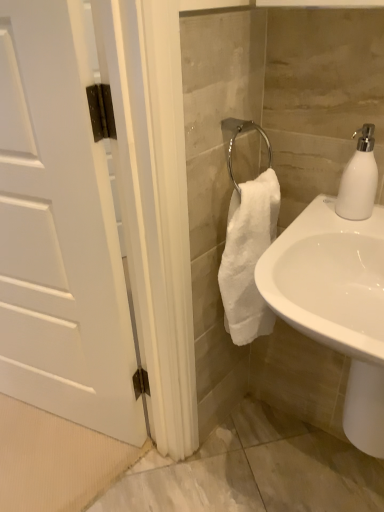
Question: Can you see white matte soap dispenser at upper right touching white matte door at left?

Choices:
 (A) no
 (B) yes

Answer: (A)

Question: Does white matte soap dispenser at upper right have a larger size compared to white matte door at left?

Choices:
 (A) no
 (B) yes

Answer: (A)

Question: From the image's perspective, is white matte soap dispenser at upper right beneath white matte door at left?

Choices:
 (A) yes
 (B) no

Answer: (B)

Question: Is white matte door at left a part of white matte soap dispenser at upper right?

Choices:
 (A) no
 (B) yes

Answer: (A)

Question: From a real-world perspective, is white matte soap dispenser at upper right physically below white matte door at left?

Choices:
 (A) no
 (B) yes

Answer: (A)

Question: Does white matte soap dispenser at upper right have a smaller size compared to white matte door at left?

Choices:
 (A) no
 (B) yes

Answer: (B)

Question: Considering the relative sizes of white glossy sink at lower right and white matte door at left in the image provided, is white glossy sink at lower right wider than white matte door at left?

Choices:
 (A) no
 (B) yes

Answer: (B)

Question: Is white glossy sink at lower right to the left of white matte door at left from the viewer's perspective?

Choices:
 (A) no
 (B) yes

Answer: (A)

Question: Does white glossy sink at lower right have a lesser height compared to white matte door at left?

Choices:
 (A) no
 (B) yes

Answer: (B)

Question: Is white matte door at left completely or partially inside white glossy sink at lower right?

Choices:
 (A) yes
 (B) no

Answer: (B)

Question: Does white glossy sink at lower right appear on the right side of white matte door at left?

Choices:
 (A) no
 (B) yes

Answer: (B)

Question: Is white glossy sink at lower right positioned beyond the bounds of white matte door at left?

Choices:
 (A) yes
 (B) no

Answer: (A)

Question: From a real-world perspective, is white matte soap dispenser at upper right under white glossy sink at lower right?

Choices:
 (A) yes
 (B) no

Answer: (B)